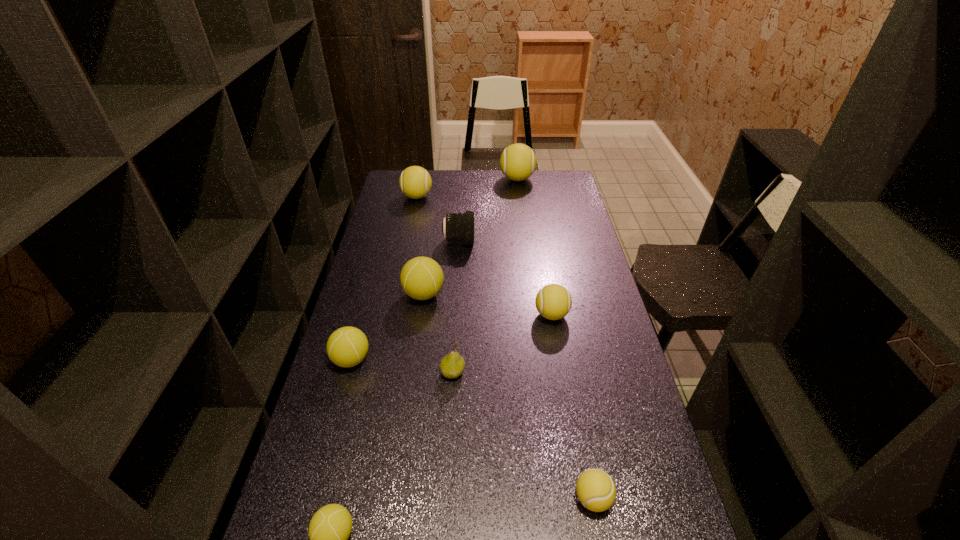
The width and height of the screenshot is (960, 540). I want to click on the farthest yellow tennis ball, so click(x=518, y=161).

Find the location of `the biggest yellow tennis ball`. the biggest yellow tennis ball is located at coordinates (518, 161).

Where is `the third nearest yellow tennis ball`? Image resolution: width=960 pixels, height=540 pixels. the third nearest yellow tennis ball is located at coordinates (415, 182).

You are a GUI agent. You are given a task and a screenshot of the screen. Output one action in this format:
    pyautogui.click(x=<x>, y=<y>)
    Task: Click on the eighth nearest object
    
    Given the screenshot: What is the action you would take?
    pyautogui.click(x=415, y=182)

At what (x,y) coordinates should I click in order to perform the action: click on the rightmost green tennis ball. Please return your answer as a coordinate pair (x, y). The image size is (960, 540). Looking at the image, I should click on (421, 278).

Where is `the biggest green tennis ball`? The height and width of the screenshot is (540, 960). the biggest green tennis ball is located at coordinates (421, 278).

Identify the location of the third farthest object. The height and width of the screenshot is (540, 960). (459, 227).

Where is `telephoto lens`? This screenshot has height=540, width=960. telephoto lens is located at coordinates pyautogui.click(x=459, y=227).

Where is `pear`? The image size is (960, 540). pear is located at coordinates (451, 366).

You are a GUI agent. You are given a task and a screenshot of the screen. Output one action in this format:
    pyautogui.click(x=<x>, y=<y>)
    Task: Click on the second smallest yellow tennis ball
    This screenshot has width=960, height=540.
    Given the screenshot: What is the action you would take?
    pyautogui.click(x=553, y=301)